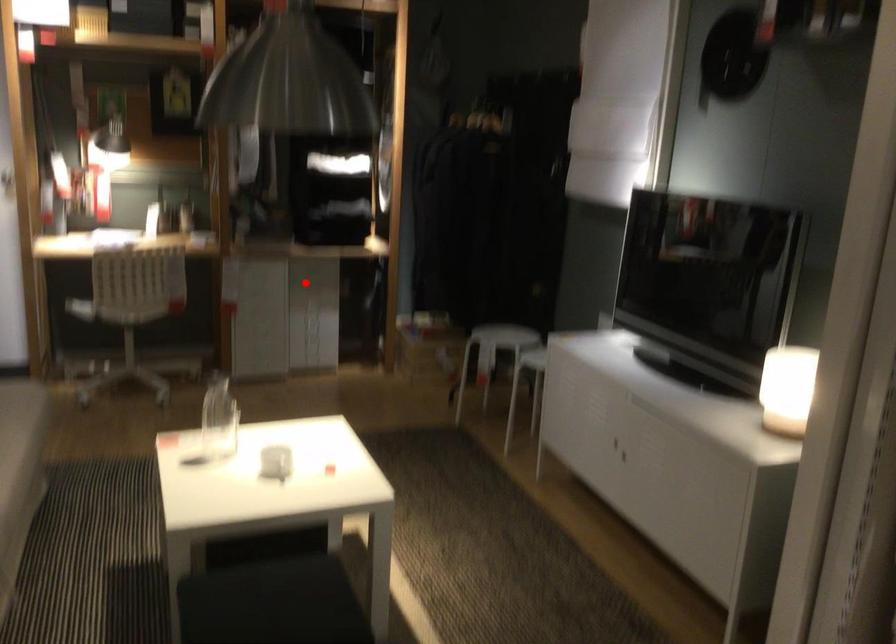
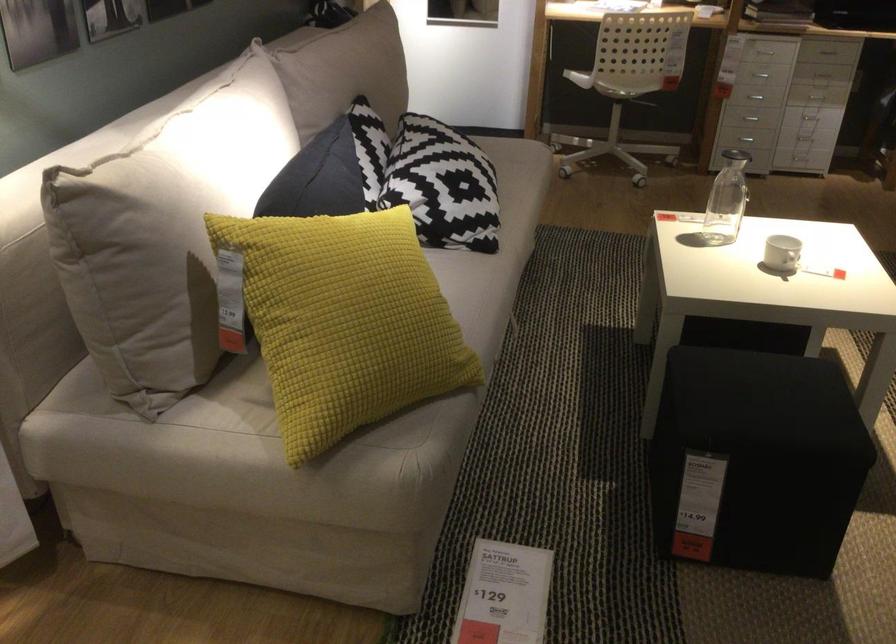
The point at the highlighted location is marked in the first image. Where is the corresponding point in the second image?

(826, 51)